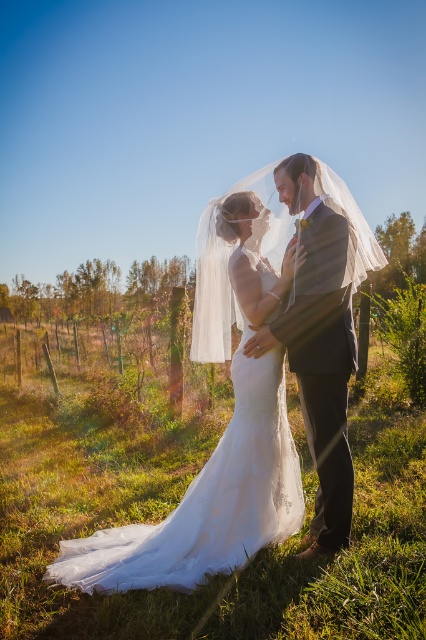
You are a photographer taking pictures of the wedding couple. You notice the white lace dress at center and the white sheer veil at center. Which one is positioned closer to you?

The white lace dress at center is closer to the viewer than the white sheer veil at center.

In the wedding scene under the clear blue sky, the couple is surrounded by grapevines. You notice the white lace dress at center and the white sheer veil at center. Which object is positioned to the right of the other?

The white lace dress at center is to the right of the white sheer veil at center.

You are a photographer at the wedding, and you want to ensure both the white lace dress at center and the white sheer veil at center are fully visible in the photo. Given their widths, which one requires more space in the frame?

The white lace dress at center requires more space in the frame since its width surpasses that of the white sheer veil at center.